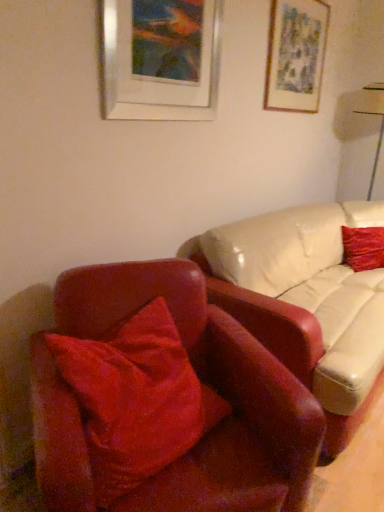
Question: From the image's perspective, does matte gray picture frame at upper right, which is the 1th picture frame in back-to-front order, appear higher than white glossy table lamp at upper right?

Choices:
 (A) yes
 (B) no

Answer: (A)

Question: Is matte gray picture frame at upper right, the second picture frame viewed from the left, far away from white glossy table lamp at upper right?

Choices:
 (A) no
 (B) yes

Answer: (B)

Question: Is matte gray picture frame at upper right, placed as the 2th picture frame when sorted from front to back, shorter than white glossy table lamp at upper right?

Choices:
 (A) no
 (B) yes

Answer: (B)

Question: Would you say matte gray picture frame at upper right, placed as the 2th picture frame when sorted from front to back, is outside white glossy table lamp at upper right?

Choices:
 (A) no
 (B) yes

Answer: (B)

Question: Does matte gray picture frame at upper right, which is the 1th picture frame in back-to-front order, have a larger size compared to white glossy table lamp at upper right?

Choices:
 (A) no
 (B) yes

Answer: (A)

Question: Considering the positions of point (86, 348) and point (380, 101), is point (86, 348) closer or farther from the camera than point (380, 101)?

Choices:
 (A) farther
 (B) closer

Answer: (B)

Question: Based on their positions, is velvet red pillow at left, the 1th pillow when ordered from left to right, located to the left or right of white glossy table lamp at upper right?

Choices:
 (A) left
 (B) right

Answer: (A)

Question: Based on their sizes in the image, would you say velvet red pillow at left, which is the 1th pillow from bottom to top, is bigger or smaller than white glossy table lamp at upper right?

Choices:
 (A) big
 (B) small

Answer: (B)

Question: From the image's perspective, relative to white glossy table lamp at upper right, is velvet red pillow at left, the 1th pillow when ordered from left to right, above or below?

Choices:
 (A) above
 (B) below

Answer: (B)

Question: Is point pyautogui.click(x=360, y=106) closer or farther from the camera than point pyautogui.click(x=380, y=264)?

Choices:
 (A) farther
 (B) closer

Answer: (A)

Question: Is white glossy table lamp at upper right inside or outside of velvet red pillow at right, the second pillow from the left?

Choices:
 (A) inside
 (B) outside

Answer: (B)

Question: Considering the positions of white glossy table lamp at upper right and velvet red pillow at right, the second pillow from the left, in the image, is white glossy table lamp at upper right taller or shorter than velvet red pillow at right, the second pillow from the left,?

Choices:
 (A) tall
 (B) short

Answer: (A)

Question: Would you say white glossy table lamp at upper right is to the left or to the right of velvet red pillow at right, the first pillow in the back-to-front sequence, in the picture?

Choices:
 (A) right
 (B) left

Answer: (A)

Question: Is point (269, 74) positioned closer to the camera than point (377, 86)?

Choices:
 (A) farther
 (B) closer

Answer: (B)

Question: Visually, is matte gray picture frame at upper right, the first picture frame viewed from the right, positioned to the left or to the right of white glossy table lamp at upper right?

Choices:
 (A) left
 (B) right

Answer: (A)